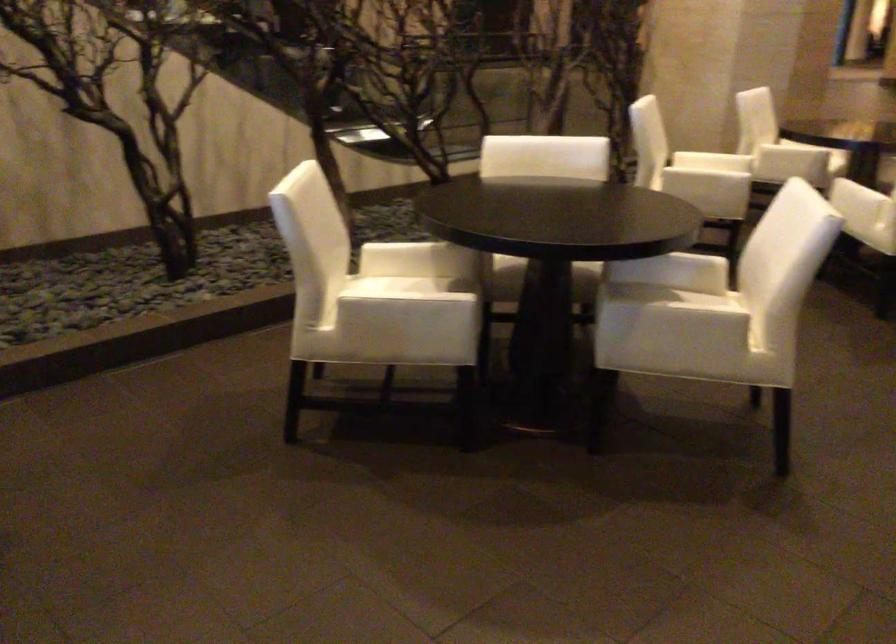
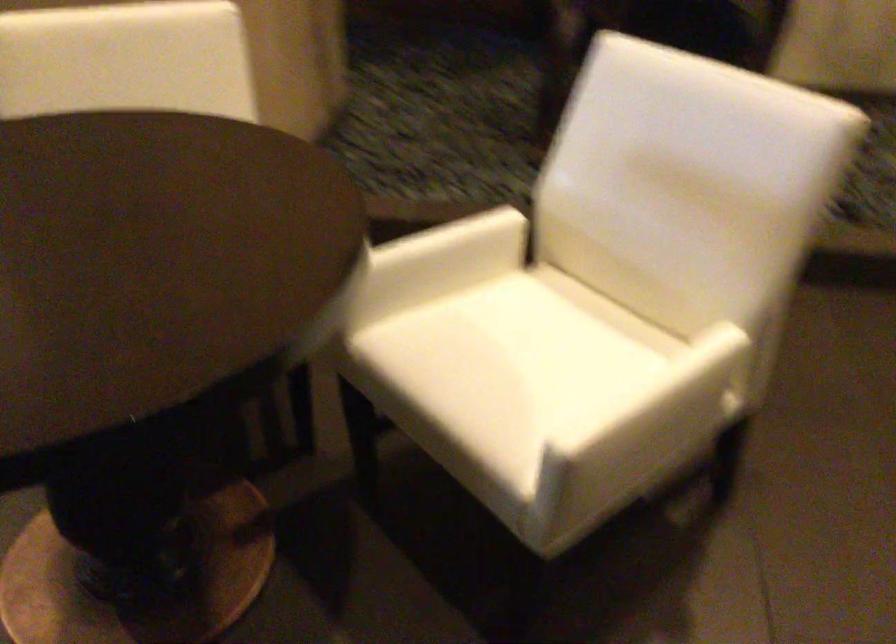
First-person continuous shooting, in which direction is the camera rotating?

The camera's rotation is toward left-down.